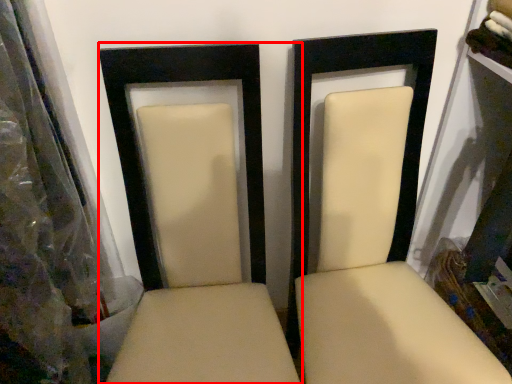
Question: From the image, what is the correct spatial relationship of chair (annotated by the red box) in relation to chair?

Choices:
 (A) left
 (B) right

Answer: (A)